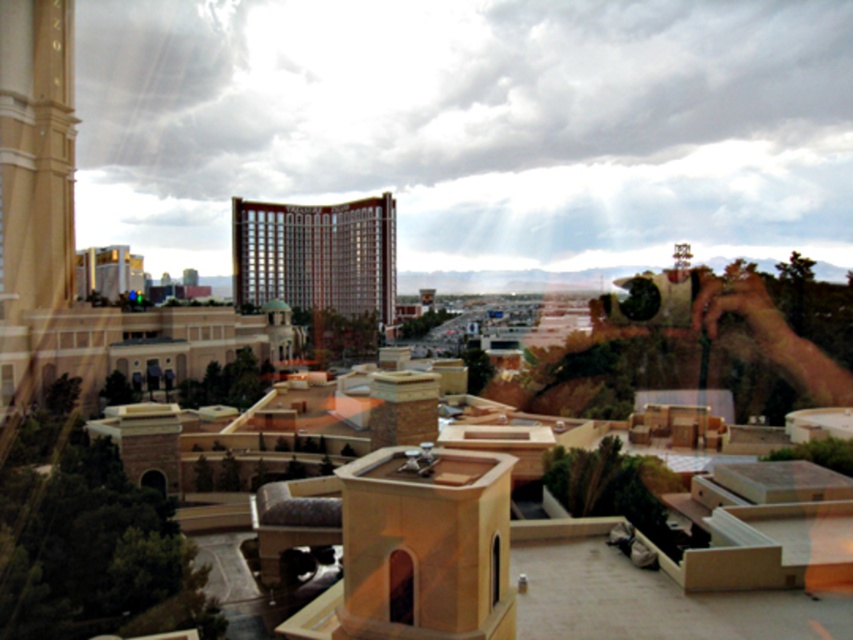
Between matte glass window at center and transparent glass window at upper left, which one has more height?

transparent glass window at upper left

Is point (397, 573) positioned before point (3, 396)?

Yes, point (397, 573) is closer to viewer.

Where is `matte glass window at center`? matte glass window at center is located at coordinates (399, 588).

Measure the distance between transparent glass window at center and transparent glass window at upper left.

transparent glass window at center is 91.74 meters from transparent glass window at upper left.

Is point (492, 548) positioned in front of point (7, 378)?

Yes, it is.

Is point (491, 589) closer to camera compared to point (4, 390)?

That is True.

Image resolution: width=853 pixels, height=640 pixels. In order to click on transparent glass window at center in this screenshot , I will do pyautogui.click(x=494, y=570).

Does point (407, 589) lie in front of point (495, 540)?

Yes, it is in front of point (495, 540).

Between point (399, 557) and point (490, 557), which one is positioned in front?

Point (399, 557)

Where is `matte glass window at center`? The height and width of the screenshot is (640, 853). matte glass window at center is located at coordinates (399, 588).

Locate an element on the screen. This screenshot has height=640, width=853. matte glass window at center is located at coordinates coord(399,588).